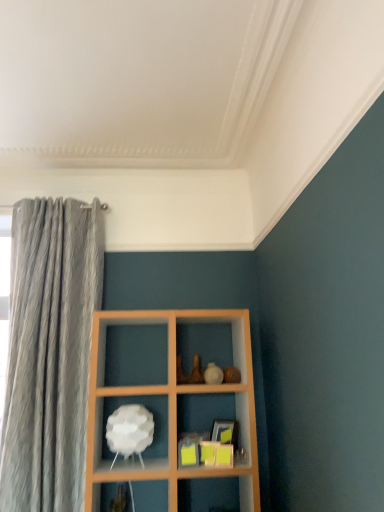
Question: Should I look upward or downward to see white matte lamp at center?

Choices:
 (A) down
 (B) up

Answer: (A)